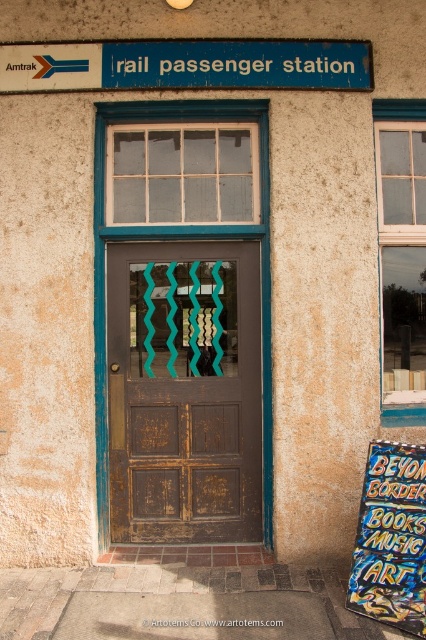
Does point (195, 387) lie behind point (115, 70)?

Yes.

Image resolution: width=426 pixels, height=640 pixels. What do you see at coordinates (184, 392) in the screenshot?
I see `brown wooden door at center` at bounding box center [184, 392].

This screenshot has height=640, width=426. Find the location of `brown wooden door at center`. brown wooden door at center is located at coordinates [x=184, y=392].